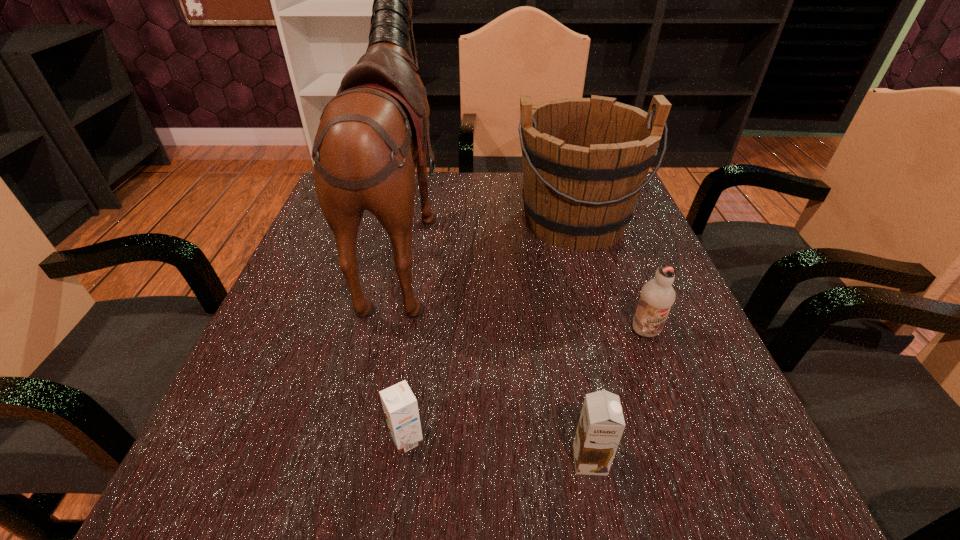
At what (x,y) coordinates should I click in order to perform the action: click on saddle. Please return your answer as a coordinate pair (x, y). Looking at the image, I should click on (371, 133).

The image size is (960, 540). Find the location of `the second tallest object`. the second tallest object is located at coordinates (585, 160).

Where is `the rightmost chocolate milk`? The width and height of the screenshot is (960, 540). the rightmost chocolate milk is located at coordinates (657, 296).

This screenshot has height=540, width=960. Find the location of `the second chocolate milk from right to left`. the second chocolate milk from right to left is located at coordinates (601, 424).

I want to click on the shortest chocolate milk, so 400,406.

At what (x,y) coordinates should I click in order to perform the action: click on the shortest object. Please return your answer as a coordinate pair (x, y). Image resolution: width=960 pixels, height=540 pixels. Looking at the image, I should click on 400,406.

Where is `free space located on the back of the saddle`? free space located on the back of the saddle is located at coordinates (576, 239).

This screenshot has height=540, width=960. Find the location of `free spot located 0.310m on the side of the wine bucket with the handle for carrying`. free spot located 0.310m on the side of the wine bucket with the handle for carrying is located at coordinates (622, 382).

Locate an element on the screen. Image resolution: width=960 pixels, height=540 pixels. blank area located 0.300m on the left of the farthest chocolate milk is located at coordinates (457, 332).

At what (x,y) coordinates should I click in order to perform the action: click on vacant area located 0.140m on the right of the second chocolate milk from right to left. Please return your answer as a coordinate pair (x, y). Image resolution: width=960 pixels, height=540 pixels. Looking at the image, I should click on (711, 460).